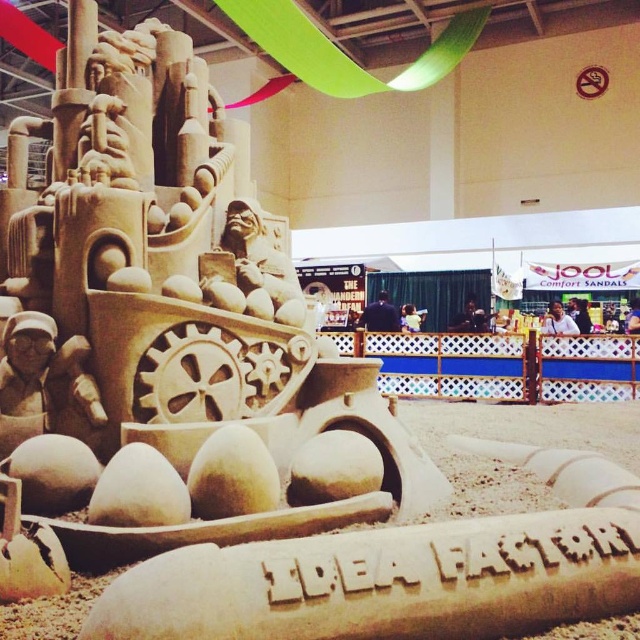
Can you confirm if sand sculpture at center is positioned above beige sand sculpture at lower center?

Yes.

Where is `sand sculpture at center`? The image size is (640, 640). sand sculpture at center is located at coordinates (172, 326).